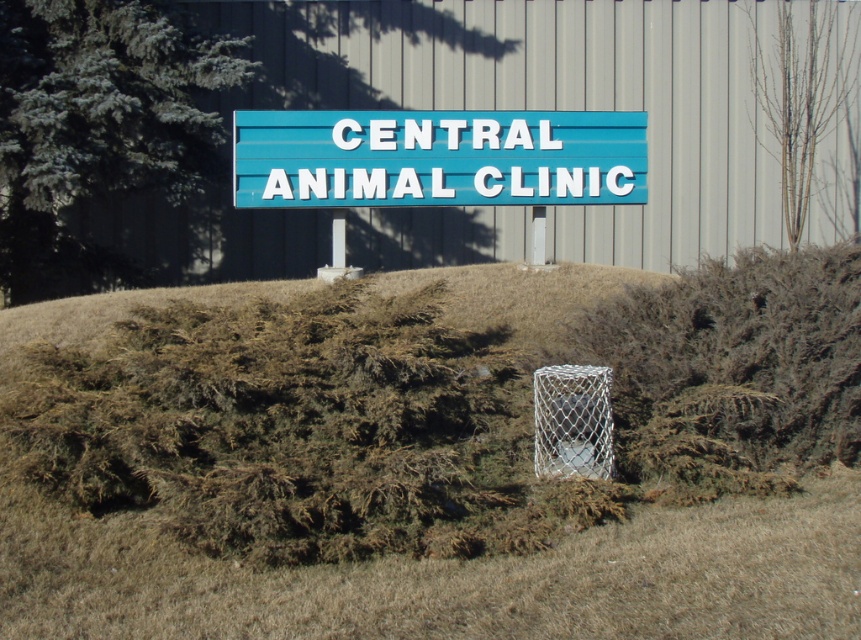
Question: Is blue plastic sign at center to the right of white mesh basketball hoop at center from the viewer's perspective?

Choices:
 (A) no
 (B) yes

Answer: (A)

Question: Is blue plastic sign at center closer to the viewer compared to white mesh basketball hoop at center?

Choices:
 (A) yes
 (B) no

Answer: (B)

Question: In this image, where is blue plastic sign at center located relative to white mesh basketball hoop at center?

Choices:
 (A) above
 (B) below

Answer: (A)

Question: Which point is farther from the camera taking this photo?

Choices:
 (A) (561, 147)
 (B) (537, 456)

Answer: (A)

Question: Which object appears closest to the camera in this image?

Choices:
 (A) blue plastic sign at center
 (B) white mesh basketball hoop at center

Answer: (B)